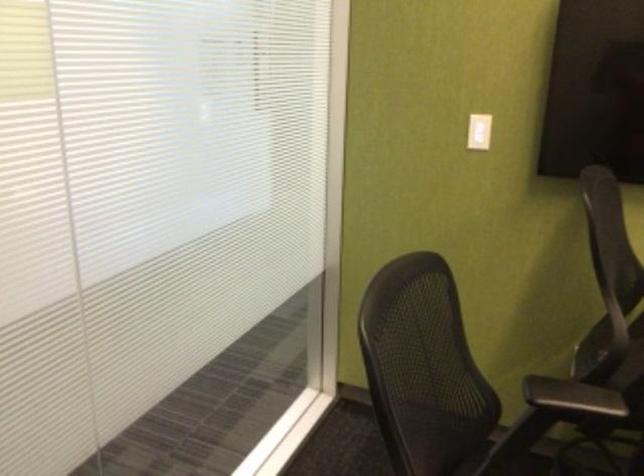
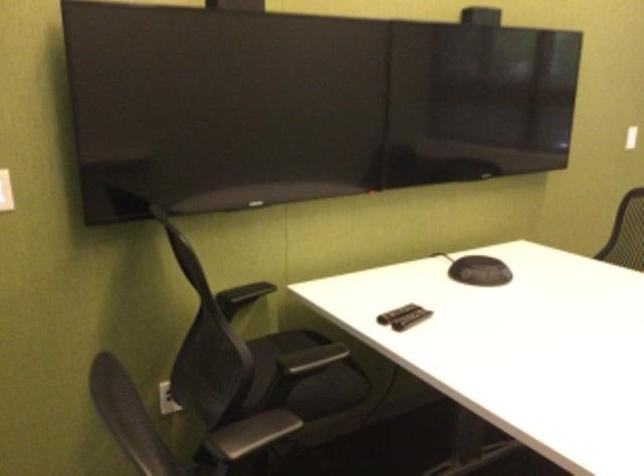
Question: The camera is either moving clockwise (left) or counter-clockwise (right) around the object. The first image is from the beginning of the video and the second image is from the end. Is the camera moving left or right when shooting the video?

Choices:
 (A) Left
 (B) Right

Answer: (A)